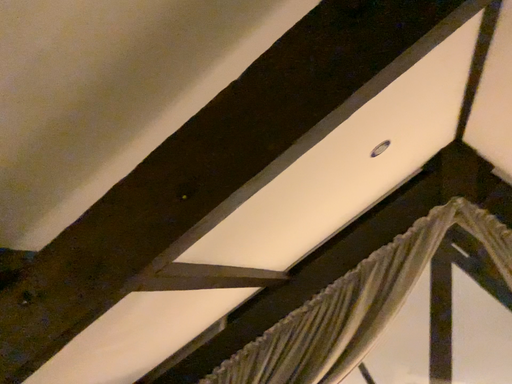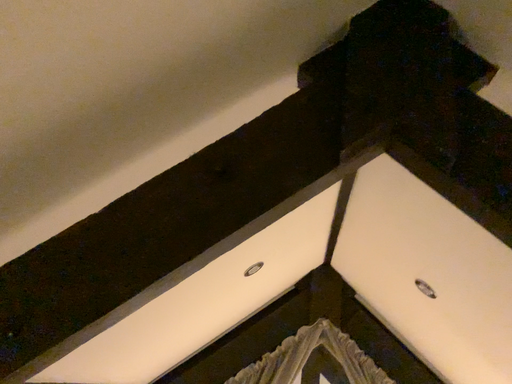
Question: Which way did the camera rotate in the video?

Choices:
 (A) rotated right
 (B) rotated left

Answer: (A)